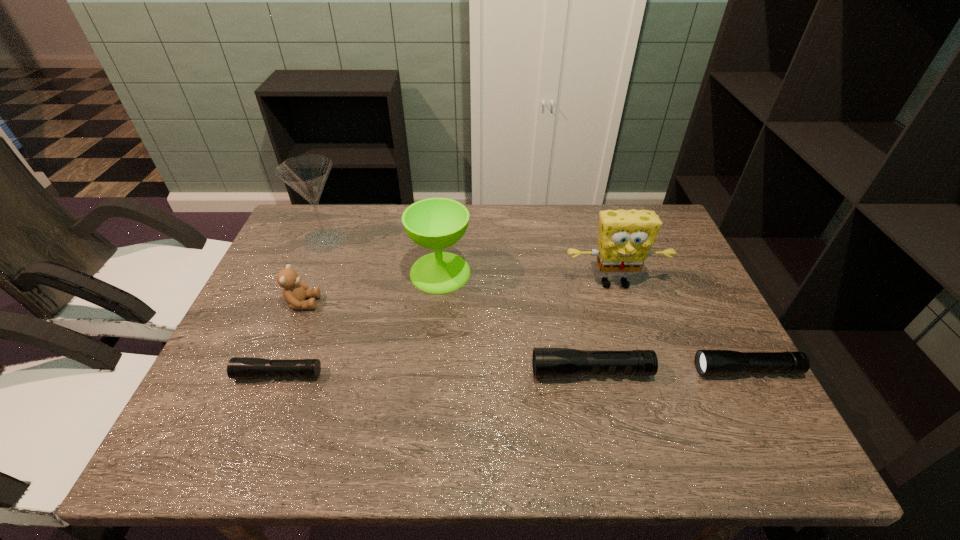
The height and width of the screenshot is (540, 960). I want to click on vacant space at the right edge of the desktop, so click(685, 276).

At what (x,y) coordinates should I click in order to perform the action: click on free space at the near right corner of the desktop. Please return your answer as a coordinate pair (x, y). The width and height of the screenshot is (960, 540). Looking at the image, I should click on (732, 413).

The height and width of the screenshot is (540, 960). Identify the location of free area in between the fourth object from right to left and the fourth shortest object. (372, 288).

Locate an element on the screen. vacant area that lies between the rightmost flashlight and the flute glass is located at coordinates (536, 305).

Find the location of `free spot between the second flashlight from left to right and the flute glass`. free spot between the second flashlight from left to right and the flute glass is located at coordinates (458, 306).

This screenshot has height=540, width=960. What are the coordinates of `free space between the fourth object from left to right and the second shortest object` in the screenshot? It's located at (593, 321).

Find the location of `vacant point located between the sponge and the wineglass`. vacant point located between the sponge and the wineglass is located at coordinates (527, 278).

The image size is (960, 540). What are the coordinates of `free spot between the wineglass and the sponge` in the screenshot? It's located at coord(527,278).

What are the coordinates of `empty space between the shortest object and the fourth object from right to left` in the screenshot? It's located at (359, 323).

Find the location of `free area in between the wineglass and the fourth tallest object`. free area in between the wineglass and the fourth tallest object is located at coordinates (372, 288).